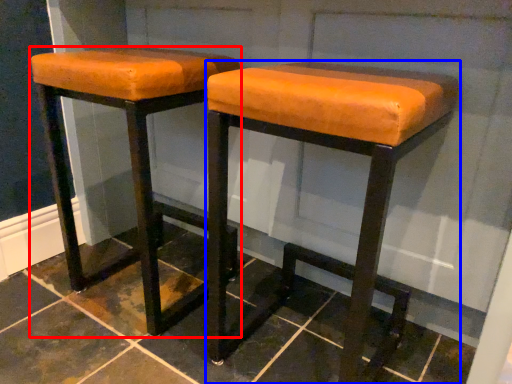
Question: Which of the following is the closest to the observer, stool (highlighted by a red box) or stool (highlighted by a blue box)?

Choices:
 (A) stool
 (B) stool

Answer: (B)